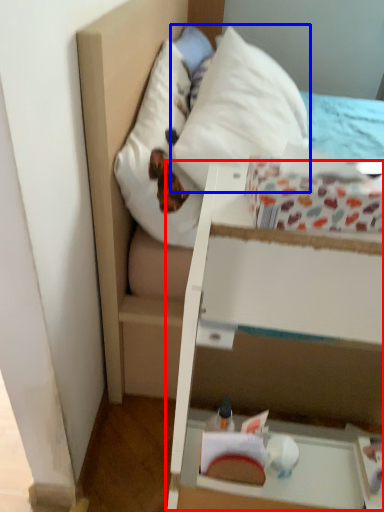
Question: Which of the following is the farthest to the observer, vanity (highlighted by a red box) or pillow (highlighted by a blue box)?

Choices:
 (A) vanity
 (B) pillow

Answer: (B)